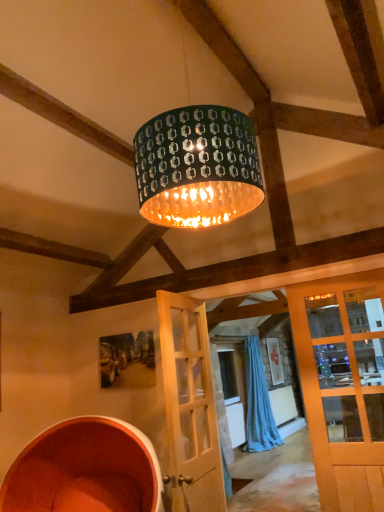
Question: Considering the positions of point (170, 330) and point (251, 381), is point (170, 330) closer or farther from the camera than point (251, 381)?

Choices:
 (A) farther
 (B) closer

Answer: (B)

Question: Looking at their shapes, would you say light wood door at center is wider or thinner than blue fabric curtain at center?

Choices:
 (A) thin
 (B) wide

Answer: (A)

Question: Estimate the real-world distances between objects in this image. Which object is closer to the light wood door at center?

Choices:
 (A) green metallic drum at center
 (B) blue fabric curtain at center

Answer: (A)

Question: Estimate the real-world distances between objects in this image. Which object is closer to the light wood door at center?

Choices:
 (A) green metallic drum at center
 (B) blue fabric curtain at center

Answer: (A)